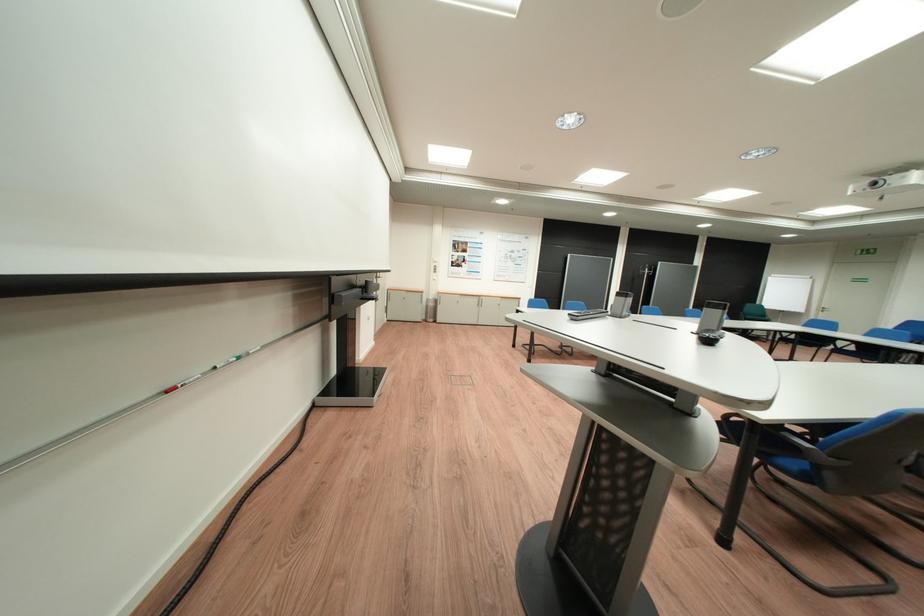
The height and width of the screenshot is (616, 924). What do you see at coordinates (791, 460) in the screenshot? I see `the blue chair sitting surface` at bounding box center [791, 460].